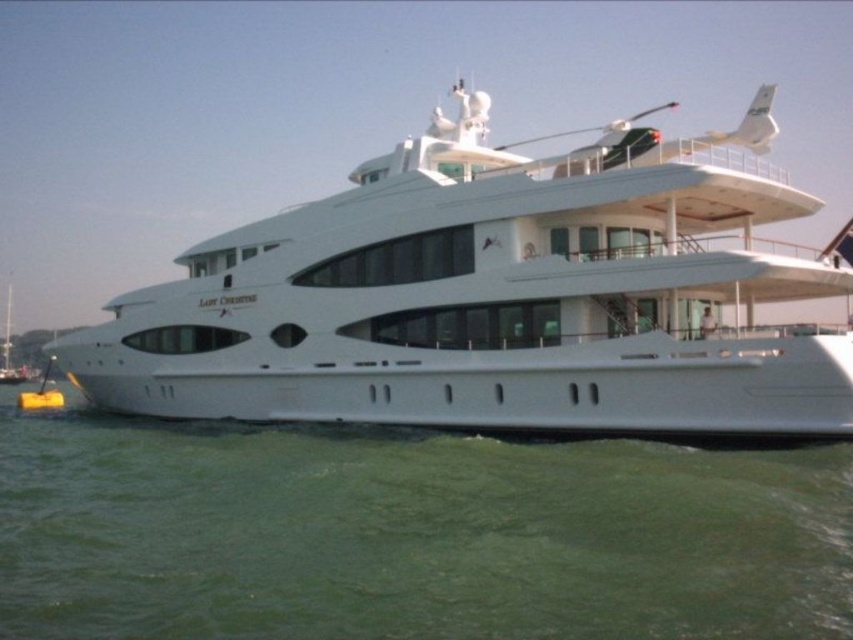
Does white glossy cruise ship at center lie in front of green water at lower center?

No, it is not.

Is white glossy cruise ship at center wider than green water at lower center?

Yes, white glossy cruise ship at center is wider than green water at lower center.

Which is in front, point (468, 307) or point (793, 618)?

Point (793, 618) is in front.

The width and height of the screenshot is (853, 640). In order to click on white glossy cruise ship at center in this screenshot , I will do `click(491, 300)`.